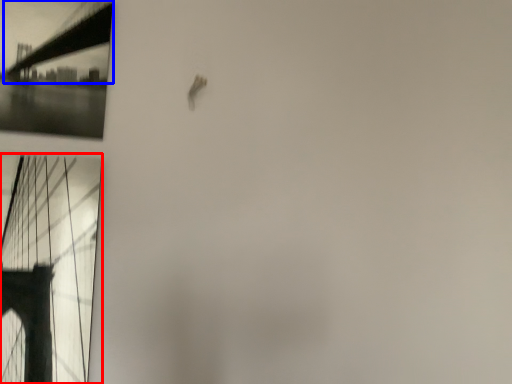
Question: Which object is closer to the camera taking this photo, window (highlighted by a red box) or suspension bridge (highlighted by a blue box)?

Choices:
 (A) window
 (B) suspension bridge

Answer: (A)